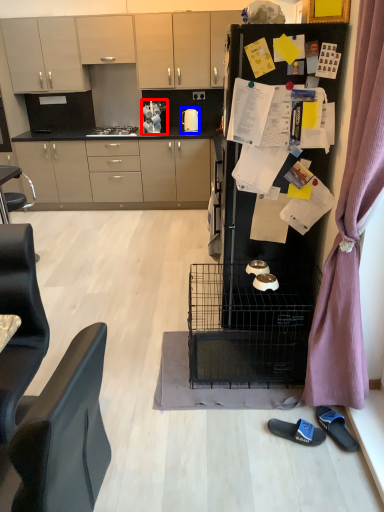
Question: Which of the following is the farthest to the observer, appliance (highlighted by a red box) or kitchen appliance (highlighted by a blue box)?

Choices:
 (A) appliance
 (B) kitchen appliance

Answer: (B)